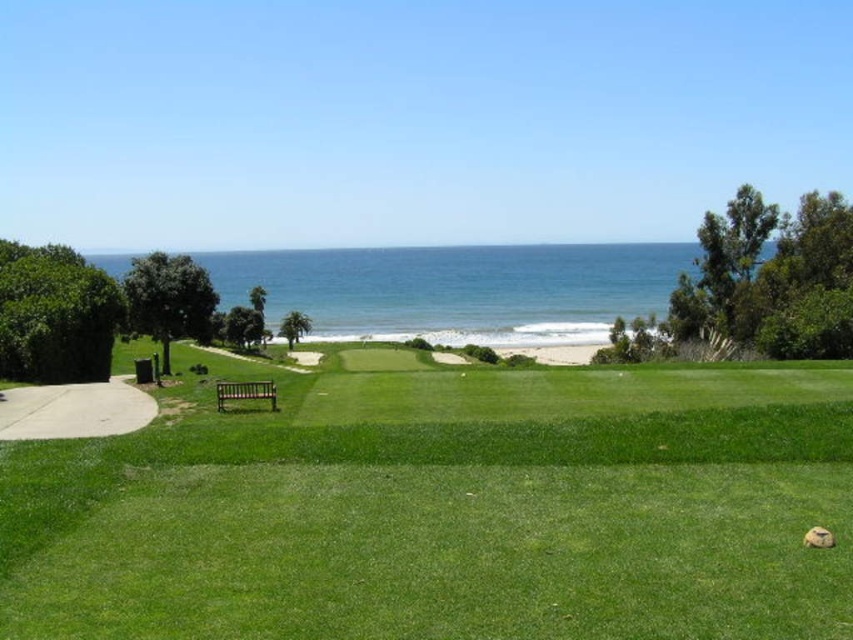
Question: Can you confirm if blue water at center is bigger than concrete at left?

Choices:
 (A) no
 (B) yes

Answer: (B)

Question: Among these points, which one is farthest from the camera?

Choices:
 (A) (541, 416)
 (B) (541, 333)
 (C) (270, 401)

Answer: (B)

Question: Which of the following is the farthest from the observer?

Choices:
 (A) green smooth grass at center
 (B) blue water at center

Answer: (B)

Question: Can you confirm if concrete at left is positioned to the left of brown wooden bench at center?

Choices:
 (A) yes
 (B) no

Answer: (A)

Question: Does concrete at left appear over brown wooden bench at center?

Choices:
 (A) yes
 (B) no

Answer: (B)

Question: Which point is closer to the camera?

Choices:
 (A) (639, 275)
 (B) (148, 397)

Answer: (B)